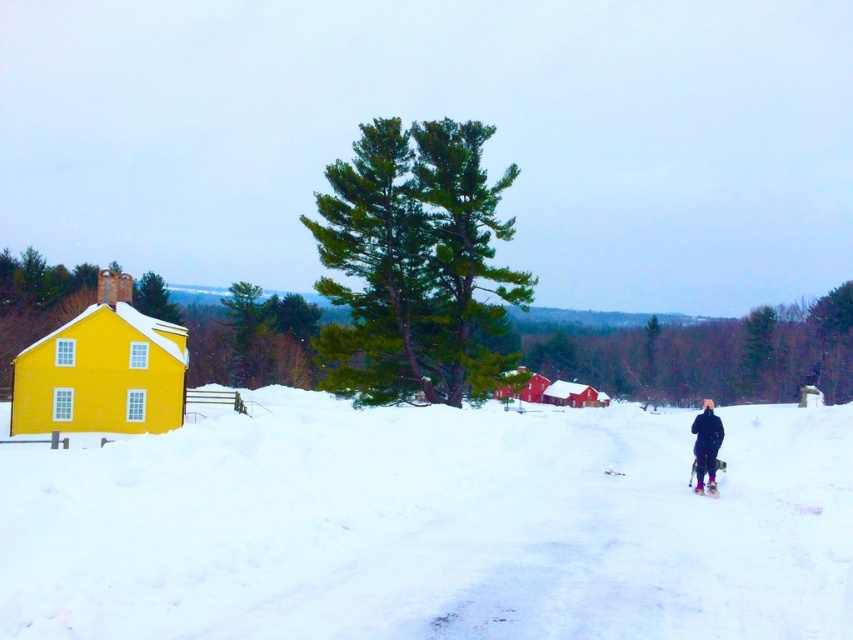
Between white fluffy snow at lower center and dark blue fabric jacket at lower right, which one appears on the left side from the viewer's perspective?

From the viewer's perspective, white fluffy snow at lower center appears more on the left side.

Is white fluffy snow at lower center closer to camera compared to dark blue fabric jacket at lower right?

Yes, white fluffy snow at lower center is in front of dark blue fabric jacket at lower right.

Which is in front, point (497, 628) or point (705, 460)?

Point (497, 628) is more forward.

Find the location of a particular element. The height and width of the screenshot is (640, 853). white fluffy snow at lower center is located at coordinates (432, 525).

Does dark blue fabric jacket at lower right have a larger size compared to matte pink ski at lower right?

Correct, dark blue fabric jacket at lower right is larger in size than matte pink ski at lower right.

This screenshot has width=853, height=640. In order to click on dark blue fabric jacket at lower right in this screenshot , I will do `click(706, 445)`.

Is white fluffy snow at lower center smaller than green needle-like at center?

Correct, white fluffy snow at lower center occupies less space than green needle-like at center.

The width and height of the screenshot is (853, 640). I want to click on white fluffy snow at lower center, so click(432, 525).

Does point (416, 529) come farther from viewer compared to point (415, 307)?

No, it is not.

Identify the location of white fluffy snow at lower center. (432, 525).